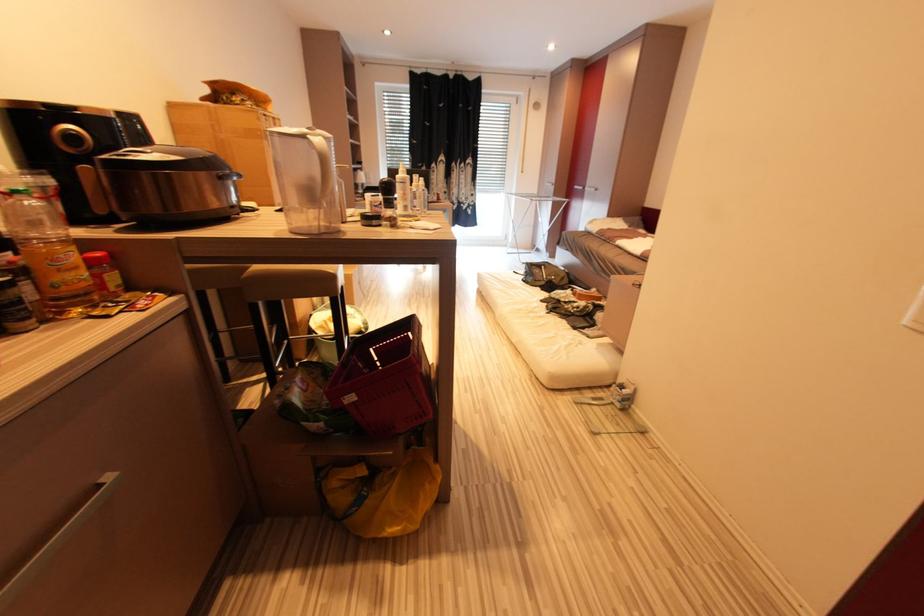
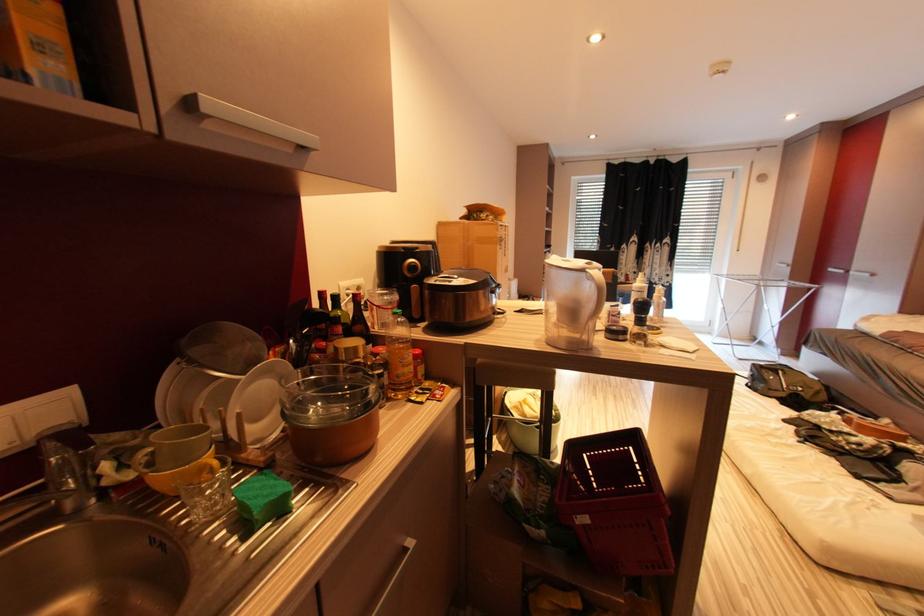
Question: The first image is from the beginning of the video and the second image is from the end. How did the camera likely rotate when shooting the video?

Choices:
 (A) Left
 (B) Right
 (C) Up
 (D) Down

Answer: (A)